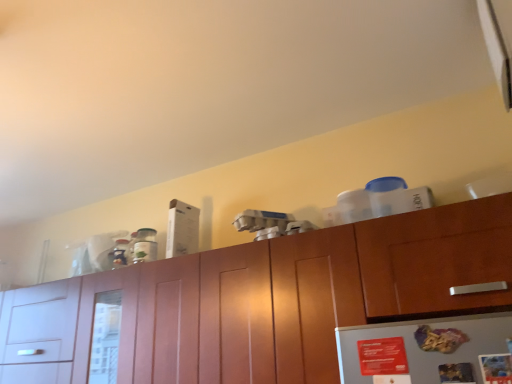
What is the approximate width of wooden cabinet at upper center?

wooden cabinet at upper center is 14.17 inches in width.

What do you see at coordinates (296, 295) in the screenshot?
I see `wooden cabinet at upper center` at bounding box center [296, 295].

What is the approximate height of wooden cabinet at upper center?

The height of wooden cabinet at upper center is 18.81 inches.

Locate an element on the screen. This screenshot has height=384, width=512. wooden cabinet at upper center is located at coordinates (296, 295).

The width and height of the screenshot is (512, 384). Find the location of `wooden cabinet at upper center`. wooden cabinet at upper center is located at coordinates (296, 295).